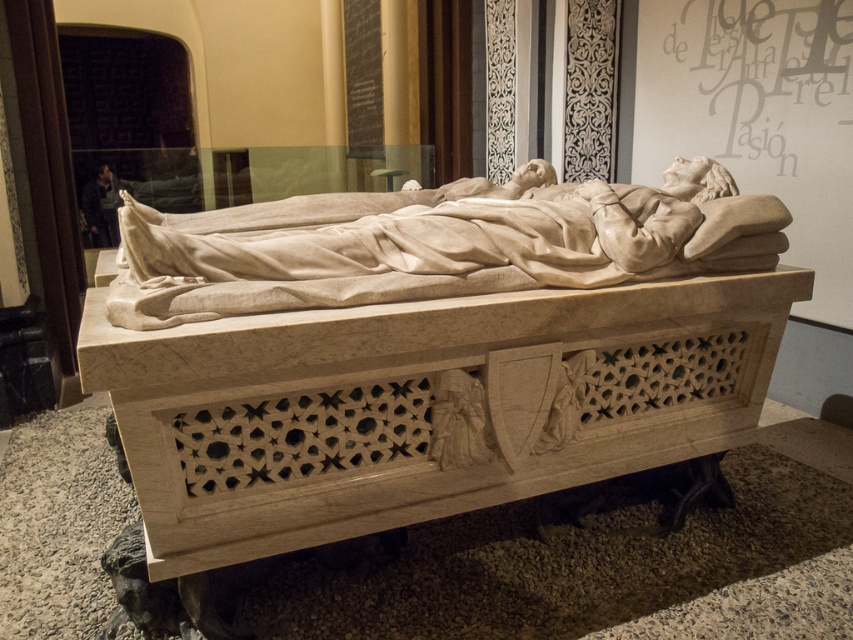
You are a museum guide standing at the entrance of the exhibit hall. You need to direct a visitor to the white marble sarcophagus at center. Which direction should they move to reach it?

The white marble sarcophagus at center is located at point coordinates (438,358), so the visitor should move towards the center of the exhibit hall to reach it.

You are a tour guide explaining the layout of the museum exhibit. Pointing to the white marble sarcophagus at center and the white marble statue at center, you want to describe their arrangement. Which object is positioned to the right of the other?

The white marble sarcophagus at center is to the right of the white marble statue at center.

You are a visitor in the museum and want to read the matte gray text at upper center. To do so, should you look above or below the white marble statue at center?

The white marble statue at center is below the matte gray text at upper center, so you should look above the white marble statue at center to read the matte gray text at upper center.